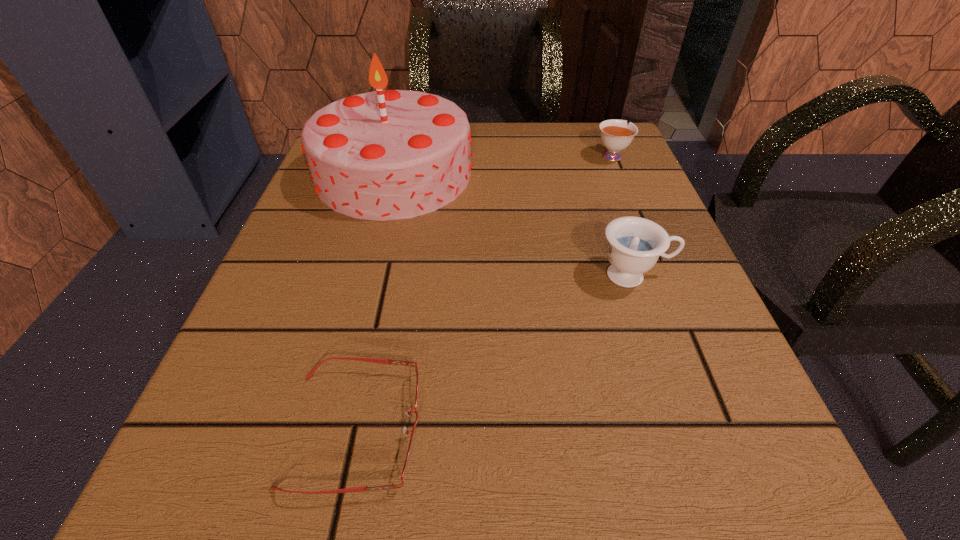
The image size is (960, 540). Find the location of `free space between the third shortest object and the tallest object`. free space between the third shortest object and the tallest object is located at coordinates (514, 225).

The height and width of the screenshot is (540, 960). What are the coordinates of `vacant area that lies between the shortest object and the third shortest object` in the screenshot? It's located at (494, 352).

What are the coordinates of `unoccupied position between the birthday cake and the nearest object` in the screenshot? It's located at (374, 301).

Locate an element on the screen. This screenshot has height=540, width=960. object that is the second closest to the third farthest object is located at coordinates (615, 134).

Identify the location of object that stands as the closest to the birthday cake. (634, 245).